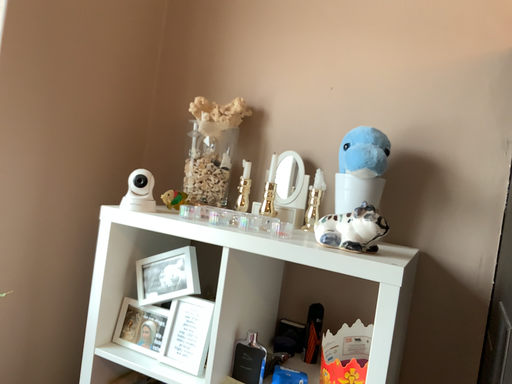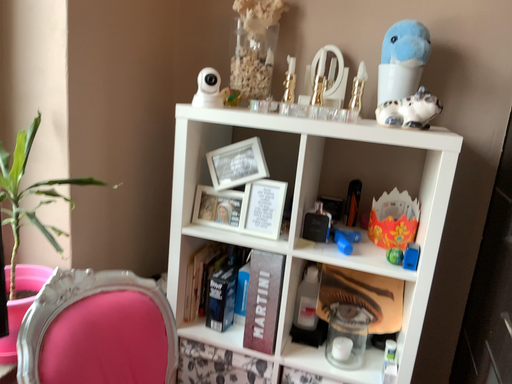
Question: Which way did the camera rotate in the video?

Choices:
 (A) rotated downward
 (B) rotated upward

Answer: (A)